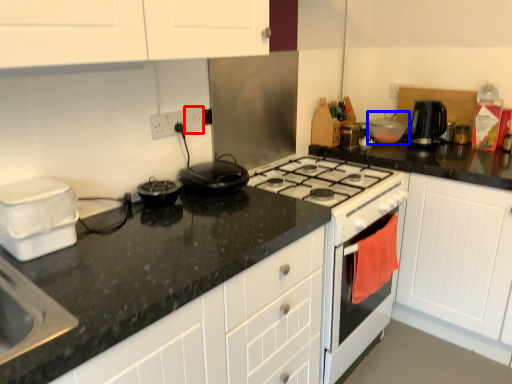
Question: Which object is further to the camera taking this photo, electric outlet (highlighted by a red box) or kitchen appliance (highlighted by a blue box)?

Choices:
 (A) electric outlet
 (B) kitchen appliance

Answer: (B)